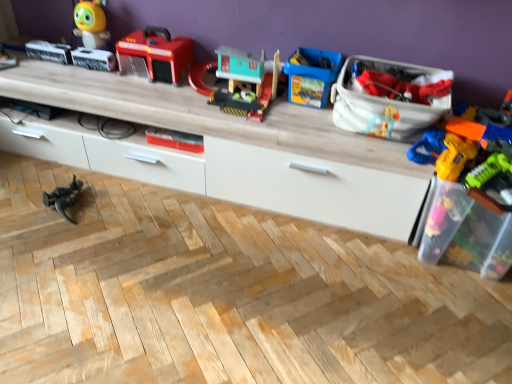
You are a GUI agent. You are given a task and a screenshot of the screen. Output one action in this format:
    pyautogui.click(x=<x>, y=<y>)
    Task: Click on the vacant area in front of black plastic dinosaur at lower left, which is the first toy from left to right
    This screenshot has width=512, height=384.
    Given the screenshot: What is the action you would take?
    pyautogui.click(x=52, y=235)